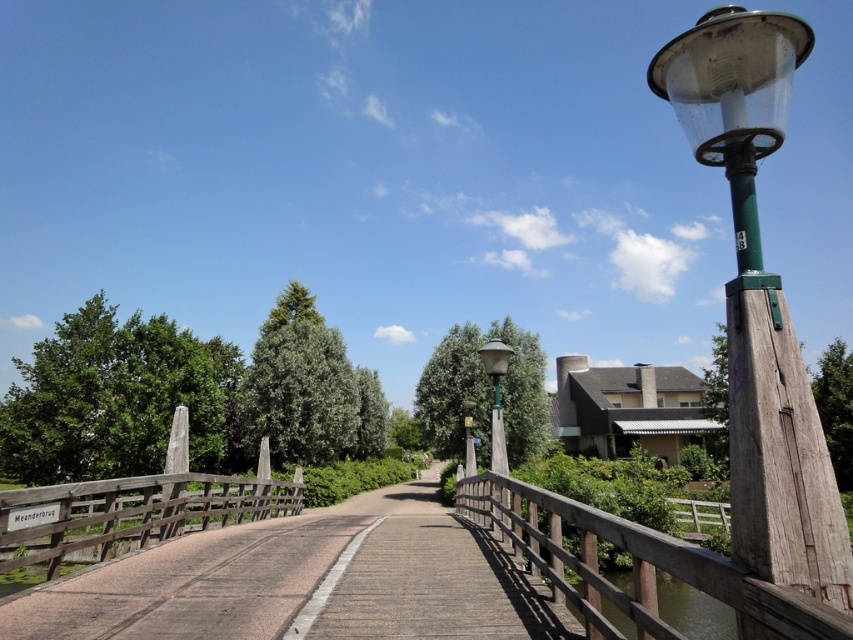
Question: Which point is closer to the camera?

Choices:
 (A) green matte street light at center
 (B) transparent water at center

Answer: (B)

Question: Is wooden bridge at right to the left of transparent water at center from the viewer's perspective?

Choices:
 (A) yes
 (B) no

Answer: (A)

Question: Is wooden bridge at right thinner than transparent water at center?

Choices:
 (A) no
 (B) yes

Answer: (B)

Question: From the image, what is the correct spatial relationship of transparent water at center in relation to green matte street light at center?

Choices:
 (A) left
 (B) right

Answer: (B)

Question: Among these objects, which one is farthest from the camera?

Choices:
 (A) wooden bridge at right
 (B) transparent water at center

Answer: (B)

Question: Which object is closer to the camera taking this photo?

Choices:
 (A) transparent water at center
 (B) green matte street light at center

Answer: (A)